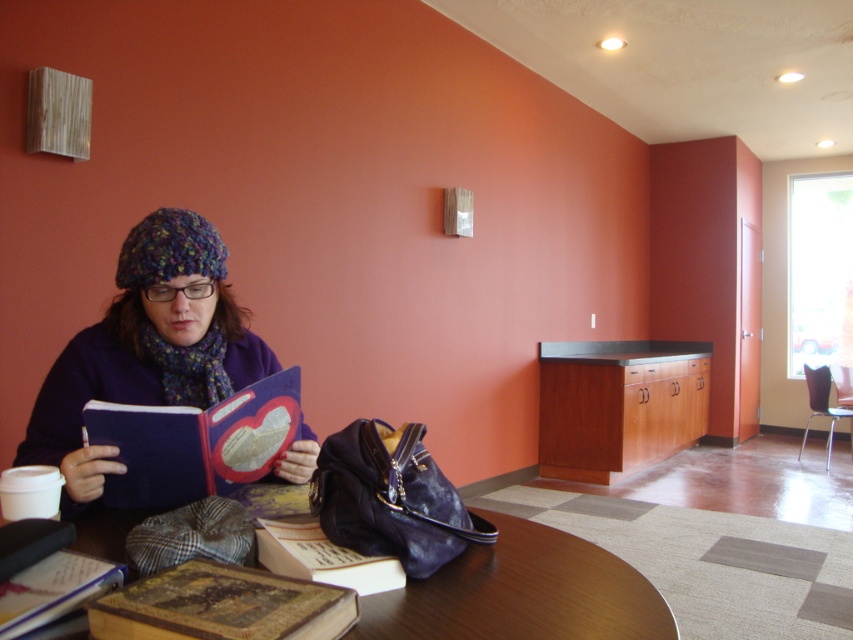
Between knitted woolen hat at left and wooden table at center, which one is positioned lower?

wooden table at center is lower down.

Who is higher up, knitted woolen hat at left or wooden table at center?

Positioned higher is knitted woolen hat at left.

Identify the location of knitted woolen hat at left. Image resolution: width=853 pixels, height=640 pixels. (148, 348).

Between leather-bound book at lower left and hardcover book at lower left, which one has more height?

With more height is leather-bound book at lower left.

This screenshot has width=853, height=640. Describe the element at coordinates (222, 605) in the screenshot. I see `leather-bound book at lower left` at that location.

The image size is (853, 640). Describe the element at coordinates (222, 605) in the screenshot. I see `leather-bound book at lower left` at that location.

This screenshot has height=640, width=853. Find the location of `leather-bound book at lower left`. leather-bound book at lower left is located at coordinates (222, 605).

At what (x,y) coordinates should I click in order to perform the action: click on wooden table at center. Please return your answer as a coordinate pair (x, y). The width and height of the screenshot is (853, 640). Looking at the image, I should click on (521, 593).

Locate an element on the screen. This screenshot has width=853, height=640. wooden table at center is located at coordinates (521, 593).